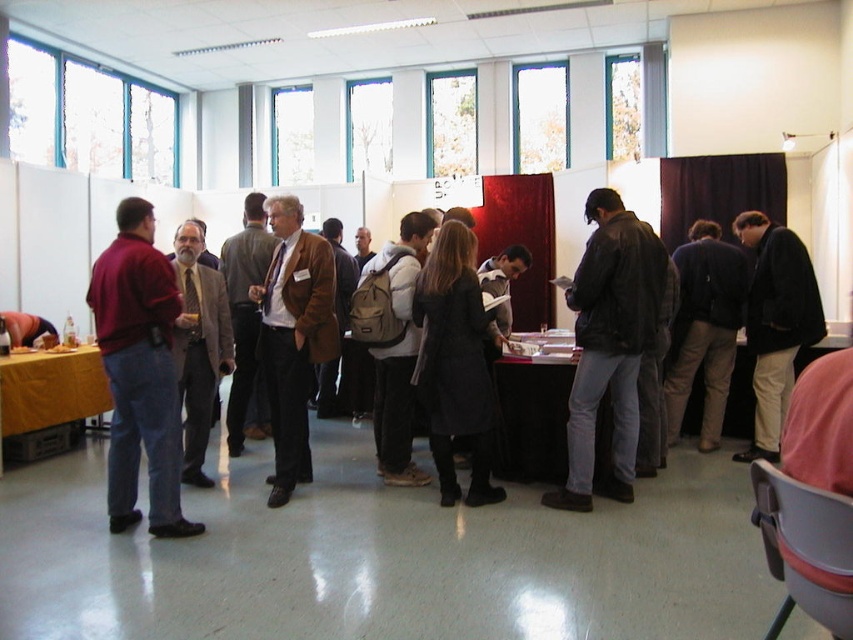
Question: Observing the image, what is the correct spatial positioning of dark brown leather jacket at right in reference to brown textured suit at center?

Choices:
 (A) right
 (B) left

Answer: (A)

Question: Can you confirm if dark brown leather jacket at right is positioned to the right of brown textured suit at center?

Choices:
 (A) no
 (B) yes

Answer: (B)

Question: Which object is positioned closest to the leather jacket at center?

Choices:
 (A) khaki backpack at center
 (B) dark brown leather jacket at right

Answer: (B)

Question: Which object appears closest to the camera in this image?

Choices:
 (A) yellow cloth-covered table at lower left
 (B) brown leather jacket at center
 (C) dark brown leather jacket at right
 (D) khaki backpack at center

Answer: (B)

Question: Which of these objects is positioned farthest from the black leather coat at center?

Choices:
 (A) dark brown leather jacket at right
 (B) black leather jacket at right

Answer: (B)

Question: Does black leather jacket at right appear on the right side of brown textured suit at center?

Choices:
 (A) yes
 (B) no

Answer: (A)